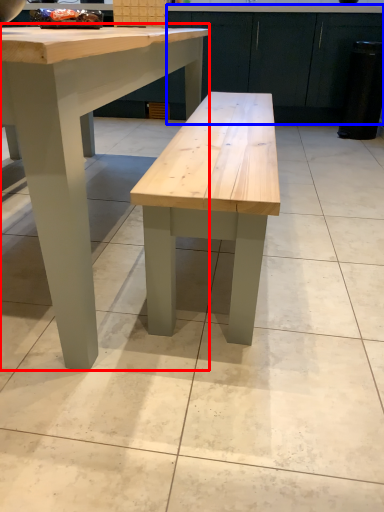
Question: Which object appears closest to the camera in this image, table (highlighted by a red box) or cabinetry (highlighted by a blue box)?

Choices:
 (A) table
 (B) cabinetry

Answer: (A)